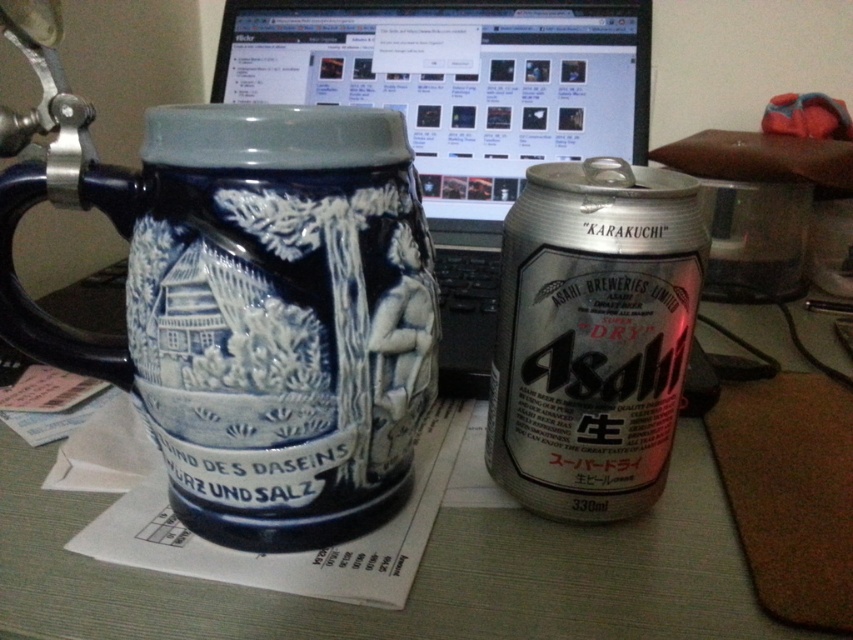
You are observing a desk with two points marked on it. The first point is at coordinates point (193, 141) and the second is at point (479, 634). Which of these points is nearer to you as you look at the desk?

Point (193, 141) is closer to the camera than point (479, 634).

You are holding a smartphone that is 6 inches long. You want to take a photo of the matte ceramic mug at center from your current position. Can your phone capture the entire mug in one shot without zooming?

The matte ceramic mug at center is 12.58 inches away from the viewer. Since the phone is 6 inches long, the distance is sufficient to capture the entire mug in one shot without zooming.

You are organizing a small desk space and need to place a 10 cm wide decorative item between the blue ceramic mug at left and the silver metallic beer can at center. Can you fit it there?

The distance between the blue ceramic mug at left and the silver metallic beer can at center is 9.08 centimeters, so the 10 cm wide decorative item cannot fit in that space.